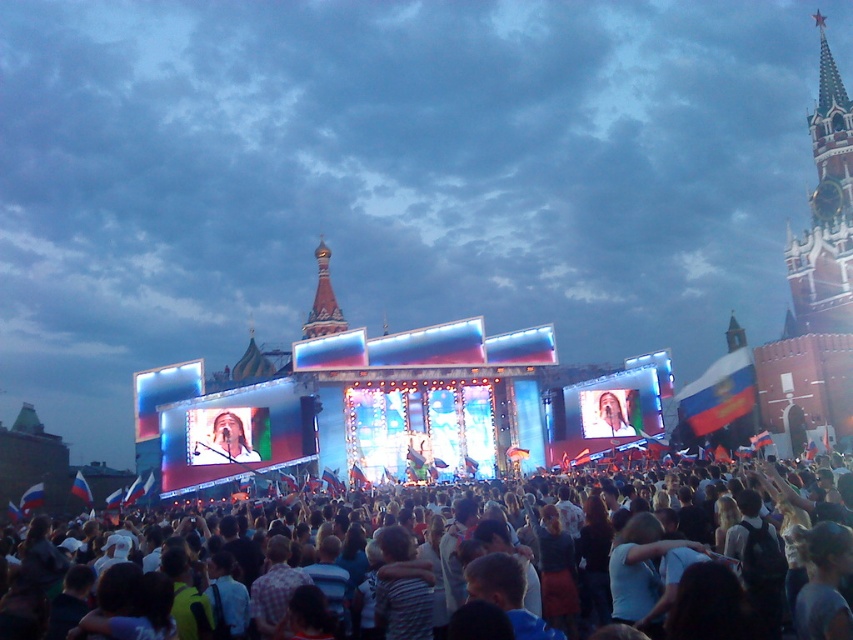
You are a photographer at the concert wanting to capture both the flag at point (300, 419) and the flag at point (614, 422) in a single shot. Which flag should you focus on first to ensure both are in frame?

You should focus on the flag at point (300, 419) first since it is in front of the flag at point (614, 422), ensuring both will be visible in the frame.

You are a photographer at the concert wanting to take a photo of the shiny gold dome at center without the matte black crowd at center blocking it. What should you do?

Since the shiny gold dome at center is taller than the matte black crowd at center, you can position yourself higher to capture the dome above the crowd.

You are standing at the concert and want to take a photo of the Kremlin and St. Basil Cathedral. There are two points marked in the image. Point A is at coordinates point [334,324] and Point B is at point [601,413]. Which point should you stand at to ensure the Kremlin and St. Basil Cathedral are fully visible without any obstruction from the crowd?

You should stand at point [601,413] because point [334,324] is behind it, meaning the crowd at point [334,324] might block the view of the Kremlin and St. Basil Cathedral.